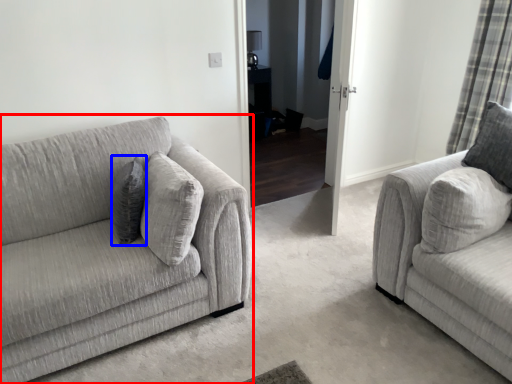
Question: Among these objects, which one is nearest to the camera, studio couch (highlighted by a red box) or pillow (highlighted by a blue box)?

Choices:
 (A) studio couch
 (B) pillow

Answer: (A)